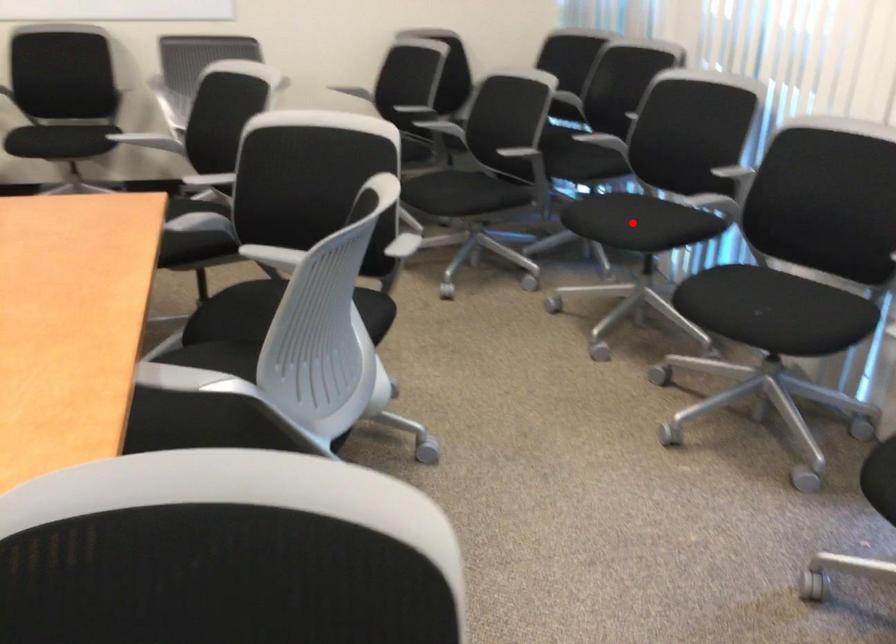
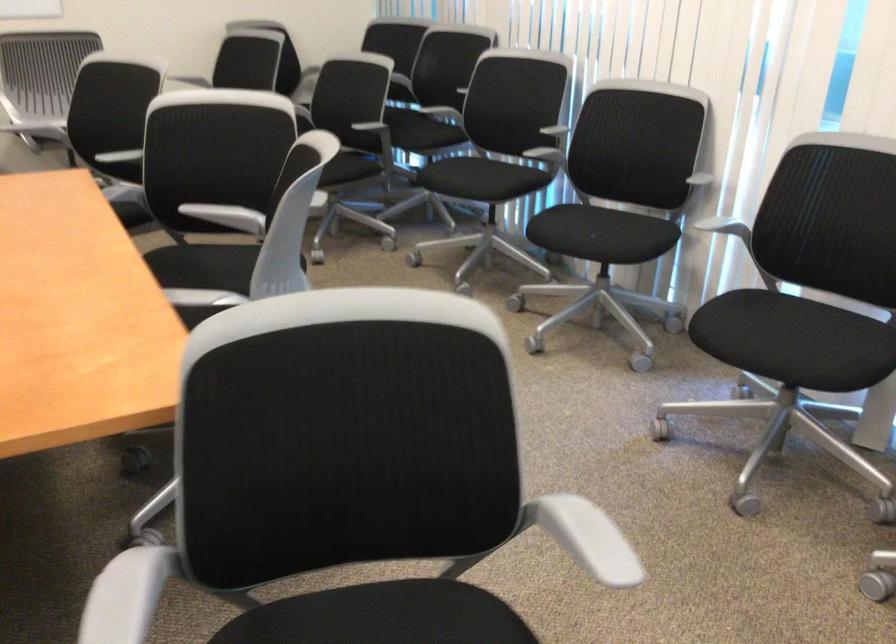
In the second image, find the point that corresponds to the highlighted location in the first image.

(480, 178)